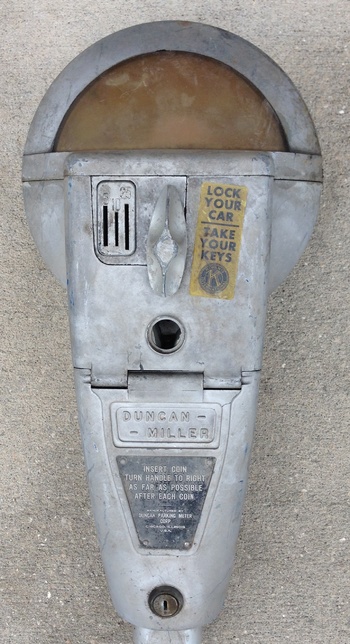
Where is `metal sign`? metal sign is located at coordinates (153, 509).